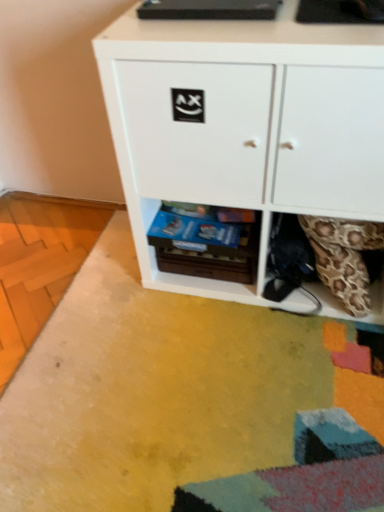
Question: Should I look upward or downward to see wooden drawer at lower center?

Choices:
 (A) up
 (B) down

Answer: (A)

Question: Is white matte cabinet at center next to wooden drawer at lower center and touching it?

Choices:
 (A) yes
 (B) no

Answer: (B)

Question: Can we say white matte cabinet at center lies outside wooden drawer at lower center?

Choices:
 (A) no
 (B) yes

Answer: (B)

Question: Does white matte cabinet at center appear on the right side of wooden drawer at lower center?

Choices:
 (A) yes
 (B) no

Answer: (A)

Question: Is white matte cabinet at center far from wooden drawer at lower center?

Choices:
 (A) no
 (B) yes

Answer: (A)

Question: Is white matte cabinet at center bigger than wooden drawer at lower center?

Choices:
 (A) no
 (B) yes

Answer: (B)

Question: Is white matte cabinet at center facing towards wooden drawer at lower center?

Choices:
 (A) yes
 (B) no

Answer: (A)

Question: Are wooden drawer at lower center and white matte cabinet at center located far from each other?

Choices:
 (A) no
 (B) yes

Answer: (A)

Question: Is wooden drawer at lower center to the left of white matte cabinet at center from the viewer's perspective?

Choices:
 (A) yes
 (B) no

Answer: (A)

Question: From a real-world perspective, is wooden drawer at lower center over white matte cabinet at center?

Choices:
 (A) no
 (B) yes

Answer: (A)

Question: Considering the relative sizes of wooden drawer at lower center and white matte cabinet at center in the image provided, is wooden drawer at lower center bigger than white matte cabinet at center?

Choices:
 (A) yes
 (B) no

Answer: (B)

Question: From a real-world perspective, does wooden drawer at lower center sit lower than white matte cabinet at center?

Choices:
 (A) no
 (B) yes

Answer: (B)

Question: Is wooden drawer at lower center wider than white matte cabinet at center?

Choices:
 (A) no
 (B) yes

Answer: (A)

Question: In the image, is white matte cabinet at center positioned in front of or behind wooden drawer at lower center?

Choices:
 (A) behind
 (B) front

Answer: (B)